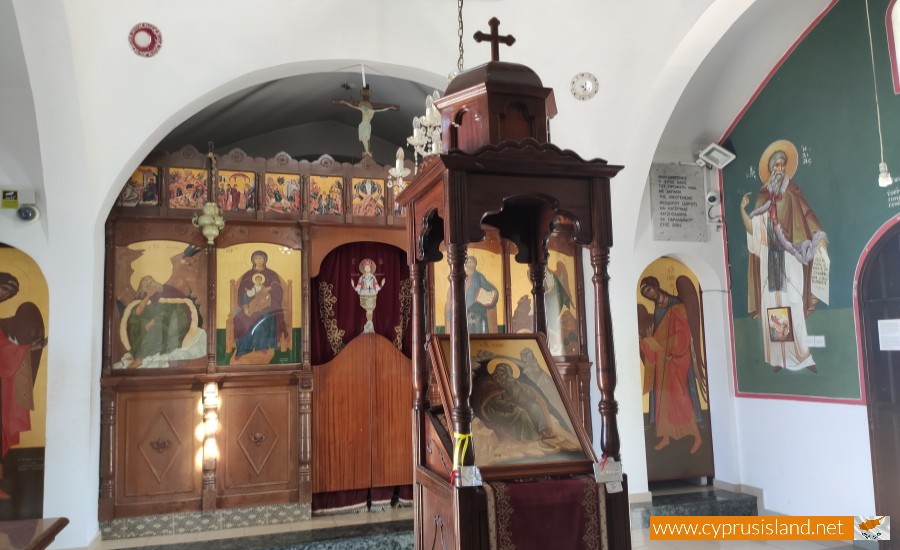
Locate an element on the screen. Image resolution: width=900 pixels, height=550 pixels. door is located at coordinates (333, 397), (388, 394), (249, 428), (129, 433).